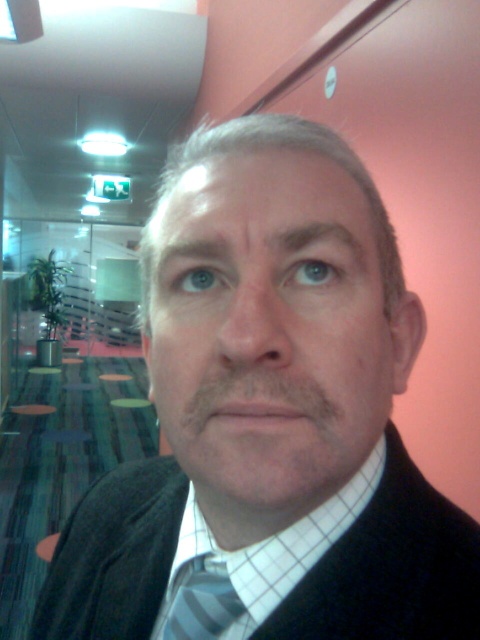
Question: Which of the following is the farthest from the observer?

Choices:
 (A) (169, 586)
 (B) (273, 561)

Answer: (A)

Question: Among these objects, which one is farthest from the camera?

Choices:
 (A) striped fabric tie at center
 (B) white checkered dress shirt at center
 (C) matte black face at center

Answer: (A)

Question: Does matte black face at center come in front of striped fabric tie at center?

Choices:
 (A) yes
 (B) no

Answer: (A)

Question: Where is matte black face at center located in relation to white checkered dress shirt at center in the image?

Choices:
 (A) right
 (B) left

Answer: (A)

Question: Which point is closer to the camera taking this photo?

Choices:
 (A) (212, 536)
 (B) (205, 376)

Answer: (B)

Question: Can you confirm if matte black face at center is positioned below striped fabric tie at center?

Choices:
 (A) no
 (B) yes

Answer: (A)